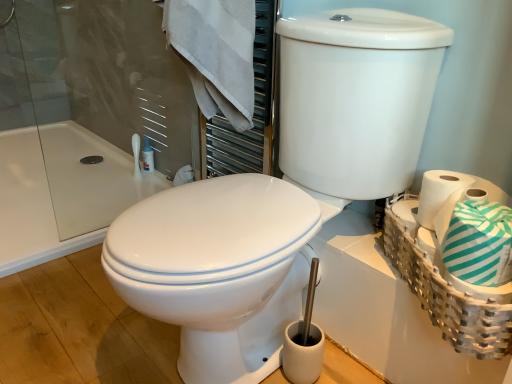
Question: Is the position of white glossy toilet at center, positioned as the 2th toilet in left-to-right order, more distant than that of white cotton towel at upper left?

Choices:
 (A) no
 (B) yes

Answer: (A)

Question: Is white glossy toilet at center, positioned as the 2th toilet in left-to-right order, bigger than white cotton towel at upper left?

Choices:
 (A) yes
 (B) no

Answer: (A)

Question: Is white glossy toilet at center, positioned as the 2th toilet in left-to-right order, taller than white cotton towel at upper left?

Choices:
 (A) no
 (B) yes

Answer: (B)

Question: Does white glossy toilet at center, positioned as the 2th toilet in left-to-right order, have a lesser height compared to white cotton towel at upper left?

Choices:
 (A) no
 (B) yes

Answer: (A)

Question: Is white glossy toilet at center, positioned as the 2th toilet in left-to-right order, next to white cotton towel at upper left?

Choices:
 (A) yes
 (B) no

Answer: (B)

Question: Is white glossy toilet at center, which is the 1th toilet from left to right, in front of or behind white glossy toilet at center, positioned as the 2th toilet in left-to-right order, in the image?

Choices:
 (A) front
 (B) behind

Answer: (B)

Question: From a real-world perspective, relative to white glossy toilet at center, which is the first toilet in right-to-left order, is white glossy toilet at center, positioned as the 2th toilet in right-to-left order, vertically above or below?

Choices:
 (A) below
 (B) above

Answer: (A)

Question: Do you think white glossy toilet at center, which is the 1th toilet from left to right, is within white glossy toilet at center, which is the first toilet in right-to-left order, or outside of it?

Choices:
 (A) outside
 (B) inside

Answer: (A)

Question: From the image's perspective, is white glossy toilet at center, positioned as the 2th toilet in right-to-left order, located above or below white glossy toilet at center, which is the first toilet in right-to-left order?

Choices:
 (A) below
 (B) above

Answer: (A)

Question: From the image's perspective, relative to teal striped toilet paper at right, is white woven basket at right above or below?

Choices:
 (A) below
 (B) above

Answer: (A)

Question: From a real-world perspective, is white woven basket at right positioned above or below teal striped toilet paper at right?

Choices:
 (A) above
 (B) below

Answer: (B)

Question: Looking at their shapes, would you say white woven basket at right is wider or thinner than teal striped toilet paper at right?

Choices:
 (A) wide
 (B) thin

Answer: (A)

Question: Looking at the image, does white woven basket at right seem bigger or smaller compared to teal striped toilet paper at right?

Choices:
 (A) big
 (B) small

Answer: (A)

Question: In terms of height, does white woven basket at right look taller or shorter compared to white cotton towel at upper left?

Choices:
 (A) tall
 (B) short

Answer: (B)

Question: Looking at their shapes, would you say white woven basket at right is wider or thinner than white cotton towel at upper left?

Choices:
 (A) thin
 (B) wide

Answer: (A)